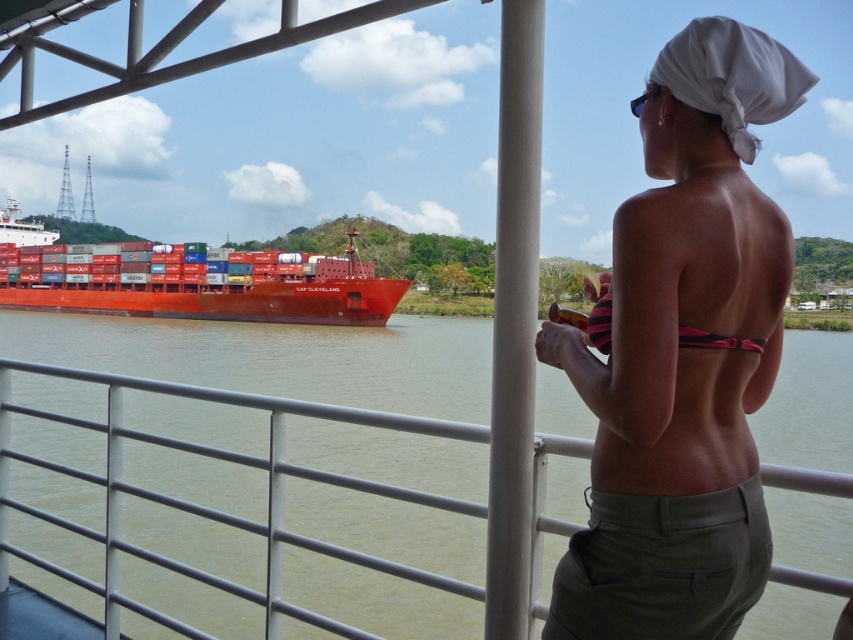
You are a photographer positioned at the center of the deck. You want to capture the matte red container ship at left in your shot. Based on its position, where should you aim your camera relative to your current position?

The matte red container ship at left is located at coordinates 0.444 on the x axis and 0.233 on the y axis, so you should aim your camera to the left and slightly downward from your current position at the center of the deck.

You are standing on the deck of the ferry and looking at two points marked in the scene. Which point is closer to you, point [813,342] or point [706,344]?

Point [706,344] is closer to you because it is less further to the viewer than point [813,342].